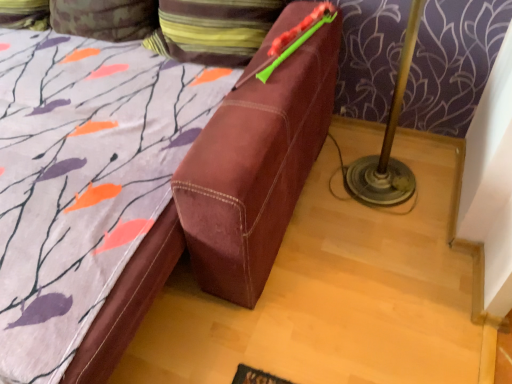
This screenshot has height=384, width=512. Describe the element at coordinates (105, 18) in the screenshot. I see `camouflage fabric pillow at upper left, marked as the 2th pillow in a right-to-left arrangement` at that location.

Find the location of a particular element. Image resolution: width=512 pixels, height=384 pixels. camouflage fabric pillow at upper left, marked as the 2th pillow in a right-to-left arrangement is located at coordinates (105, 18).

In order to face velvety brown pillow at upper center, the 2th pillow from the left, should I rotate leftwards or rightwards?

Turn left approximately 5.724 degrees to face it.

Locate an element on the screen. The image size is (512, 384). velvety brown pillow at upper center, the 2th pillow from the left is located at coordinates (213, 30).

Describe the element at coordinates (213, 30) in the screenshot. I see `velvety brown pillow at upper center, arranged as the 1th pillow when viewed from the right` at that location.

What is the approximate width of velvety brown pillow at upper center, arranged as the 1th pillow when viewed from the right?

velvety brown pillow at upper center, arranged as the 1th pillow when viewed from the right, is 13.92 inches wide.

Find the location of a particular element. This screenshot has width=512, height=384. camouflage fabric pillow at upper left, marked as the 2th pillow in a right-to-left arrangement is located at coordinates (105, 18).

Is velvety brown pillow at upper center, arranged as the 1th pillow when viewed from the right, to the left of camouflage fabric pillow at upper left, marked as the 2th pillow in a right-to-left arrangement, from the viewer's perspective?

Incorrect, velvety brown pillow at upper center, arranged as the 1th pillow when viewed from the right, is not on the left side of camouflage fabric pillow at upper left, marked as the 2th pillow in a right-to-left arrangement.

Looking at this image, which object is more forward, velvety brown pillow at upper center, arranged as the 1th pillow when viewed from the right, or camouflage fabric pillow at upper left, marked as the 2th pillow in a right-to-left arrangement?

velvety brown pillow at upper center, arranged as the 1th pillow when viewed from the right, is in front.

Considering the positions of point (273, 6) and point (116, 25), is point (273, 6) closer or farther from the camera than point (116, 25)?

Point (273, 6) is positioned closer to the camera compared to point (116, 25).

From the image's perspective, between velvety brown pillow at upper center, arranged as the 1th pillow when viewed from the right, and camouflage fabric pillow at upper left, marked as the 2th pillow in a right-to-left arrangement, who is located below?

velvety brown pillow at upper center, arranged as the 1th pillow when viewed from the right.

From a real-world perspective, which is physically above, velvety brown pillow at upper center, arranged as the 1th pillow when viewed from the right, or camouflage fabric pillow at upper left, placed as the first pillow when sorted from left to right?

From a 3D spatial view, velvety brown pillow at upper center, arranged as the 1th pillow when viewed from the right, is above.

Can you confirm if velvety brown pillow at upper center, the 2th pillow from the left, is wider than camouflage fabric pillow at upper left, marked as the 2th pillow in a right-to-left arrangement?

Indeed, velvety brown pillow at upper center, the 2th pillow from the left, has a greater width compared to camouflage fabric pillow at upper left, marked as the 2th pillow in a right-to-left arrangement.

Who is shorter, velvety brown pillow at upper center, arranged as the 1th pillow when viewed from the right, or camouflage fabric pillow at upper left, placed as the first pillow when sorted from left to right?

Standing shorter between the two is camouflage fabric pillow at upper left, placed as the first pillow when sorted from left to right.

Based on their sizes in the image, would you say velvety brown pillow at upper center, the 2th pillow from the left, is bigger or smaller than camouflage fabric pillow at upper left, placed as the first pillow when sorted from left to right?

Considering their sizes, velvety brown pillow at upper center, the 2th pillow from the left, takes up more space than camouflage fabric pillow at upper left, placed as the first pillow when sorted from left to right.

Is camouflage fabric pillow at upper left, marked as the 2th pillow in a right-to-left arrangement, inside velvety brown pillow at upper center, the 2th pillow from the left?

No, camouflage fabric pillow at upper left, marked as the 2th pillow in a right-to-left arrangement, is not a part of velvety brown pillow at upper center, the 2th pillow from the left.

Are velvety brown pillow at upper center, arranged as the 1th pillow when viewed from the right, and camouflage fabric pillow at upper left, marked as the 2th pillow in a right-to-left arrangement, far apart?

No.

Consider the image. Is velvety brown pillow at upper center, the 2th pillow from the left, facing towards camouflage fabric pillow at upper left, marked as the 2th pillow in a right-to-left arrangement?

No, velvety brown pillow at upper center, the 2th pillow from the left, is not aimed at camouflage fabric pillow at upper left, marked as the 2th pillow in a right-to-left arrangement.

Can you tell me how much velvety brown pillow at upper center, arranged as the 1th pillow when viewed from the right, and camouflage fabric pillow at upper left, marked as the 2th pillow in a right-to-left arrangement, differ in facing direction?

The angle between the facing direction of velvety brown pillow at upper center, arranged as the 1th pillow when viewed from the right, and the facing direction of camouflage fabric pillow at upper left, marked as the 2th pillow in a right-to-left arrangement, is 3.98e-05 degrees.

Locate an element on the screen. Image resolution: width=512 pixels, height=384 pixels. pillow above the velvety brown pillow at upper center, arranged as the 1th pillow when viewed from the right (from the image's perspective) is located at coordinates (105, 18).

Is camouflage fabric pillow at upper left, marked as the 2th pillow in a right-to-left arrangement, to the left of velvety brown pillow at upper center, arranged as the 1th pillow when viewed from the right, from the viewer's perspective?

Correct, you'll find camouflage fabric pillow at upper left, marked as the 2th pillow in a right-to-left arrangement, to the left of velvety brown pillow at upper center, arranged as the 1th pillow when viewed from the right.

Considering the positions of objects camouflage fabric pillow at upper left, placed as the first pillow when sorted from left to right, and velvety brown pillow at upper center, the 2th pillow from the left, in the image provided, who is behind, camouflage fabric pillow at upper left, placed as the first pillow when sorted from left to right, or velvety brown pillow at upper center, the 2th pillow from the left,?

camouflage fabric pillow at upper left, placed as the first pillow when sorted from left to right.

Considering the points (96, 28) and (248, 52), which point is behind, point (96, 28) or point (248, 52)?

The point (96, 28) is more distant.

From the image's perspective, which object appears higher, camouflage fabric pillow at upper left, marked as the 2th pillow in a right-to-left arrangement, or velvety brown pillow at upper center, arranged as the 1th pillow when viewed from the right?

camouflage fabric pillow at upper left, marked as the 2th pillow in a right-to-left arrangement.

From a real-world perspective, which is physically above, camouflage fabric pillow at upper left, marked as the 2th pillow in a right-to-left arrangement, or velvety brown pillow at upper center, arranged as the 1th pillow when viewed from the right?

velvety brown pillow at upper center, arranged as the 1th pillow when viewed from the right.

Can you confirm if camouflage fabric pillow at upper left, marked as the 2th pillow in a right-to-left arrangement, is thinner than velvety brown pillow at upper center, arranged as the 1th pillow when viewed from the right?

Indeed, camouflage fabric pillow at upper left, marked as the 2th pillow in a right-to-left arrangement, has a lesser width compared to velvety brown pillow at upper center, arranged as the 1th pillow when viewed from the right.

Considering the sizes of camouflage fabric pillow at upper left, marked as the 2th pillow in a right-to-left arrangement, and velvety brown pillow at upper center, arranged as the 1th pillow when viewed from the right, in the image, is camouflage fabric pillow at upper left, marked as the 2th pillow in a right-to-left arrangement, taller or shorter than velvety brown pillow at upper center, arranged as the 1th pillow when viewed from the right,?

Considering their sizes, camouflage fabric pillow at upper left, marked as the 2th pillow in a right-to-left arrangement, has less height than velvety brown pillow at upper center, arranged as the 1th pillow when viewed from the right.

In terms of size, does camouflage fabric pillow at upper left, placed as the first pillow when sorted from left to right, appear bigger or smaller than velvety brown pillow at upper center, the 2th pillow from the left?

Considering their sizes, camouflage fabric pillow at upper left, placed as the first pillow when sorted from left to right, takes up less space than velvety brown pillow at upper center, the 2th pillow from the left.

Is camouflage fabric pillow at upper left, placed as the first pillow when sorted from left to right, located outside velvety brown pillow at upper center, arranged as the 1th pillow when viewed from the right?

Indeed, camouflage fabric pillow at upper left, placed as the first pillow when sorted from left to right, is completely outside velvety brown pillow at upper center, arranged as the 1th pillow when viewed from the right.

Is camouflage fabric pillow at upper left, placed as the first pillow when sorted from left to right, next to velvety brown pillow at upper center, arranged as the 1th pillow when viewed from the right?

camouflage fabric pillow at upper left, placed as the first pillow when sorted from left to right, and velvety brown pillow at upper center, arranged as the 1th pillow when viewed from the right, are clearly separated.

Is camouflage fabric pillow at upper left, marked as the 2th pillow in a right-to-left arrangement, facing away from velvety brown pillow at upper center, arranged as the 1th pillow when viewed from the right?

camouflage fabric pillow at upper left, marked as the 2th pillow in a right-to-left arrangement, is not turned away from velvety brown pillow at upper center, arranged as the 1th pillow when viewed from the right.

How many degrees apart are the facing directions of camouflage fabric pillow at upper left, marked as the 2th pillow in a right-to-left arrangement, and velvety brown pillow at upper center, arranged as the 1th pillow when viewed from the right?

The angular difference between camouflage fabric pillow at upper left, marked as the 2th pillow in a right-to-left arrangement, and velvety brown pillow at upper center, arranged as the 1th pillow when viewed from the right, is 3.98e-05 degrees.

The image size is (512, 384). In order to click on pillow located in front of the camouflage fabric pillow at upper left, marked as the 2th pillow in a right-to-left arrangement in this screenshot , I will do [213, 30].

This screenshot has width=512, height=384. Identify the location of pillow lying in front of the camouflage fabric pillow at upper left, placed as the first pillow when sorted from left to right. (213, 30).

What are the coordinates of `pillow above the velvety brown pillow at upper center, arranged as the 1th pillow when viewed from the right (from the image's perspective)` in the screenshot? It's located at (105, 18).